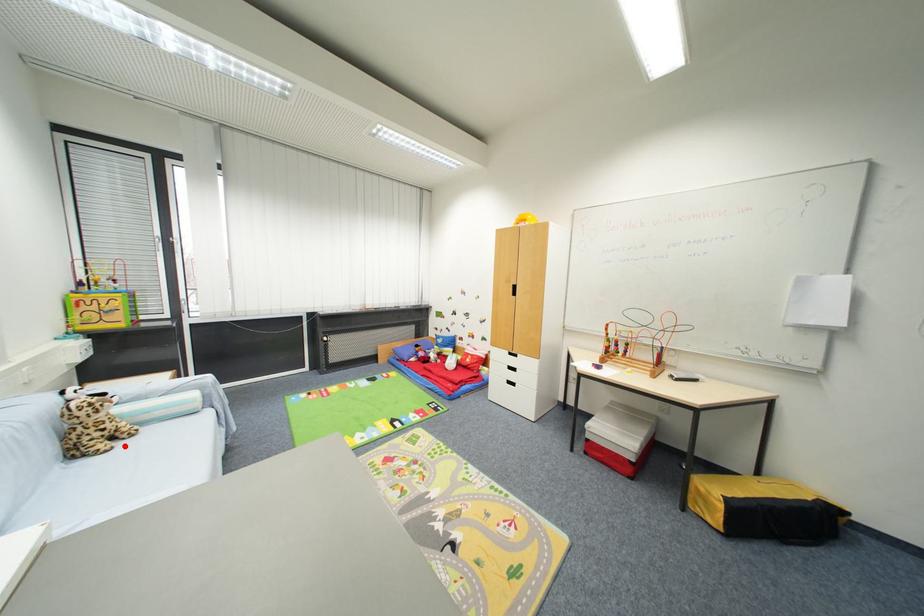
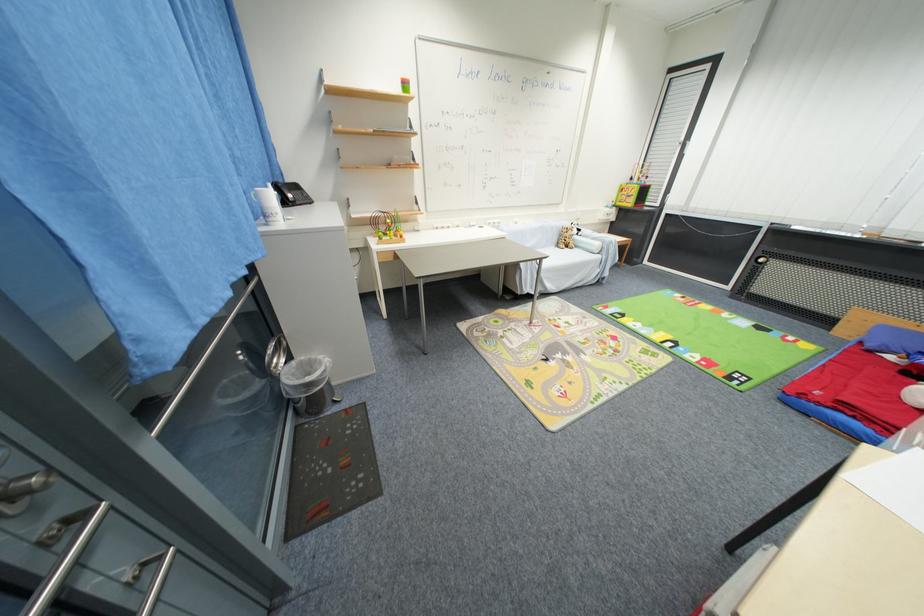
Question: I am providing you with two images of the same scene from different viewpoints. Given a red point in image1, look at the same physical point in image2. Is it:

Choices:
 (A) Closer to the viewpoint
 (B) Farther from the viewpoint

Answer: (B)